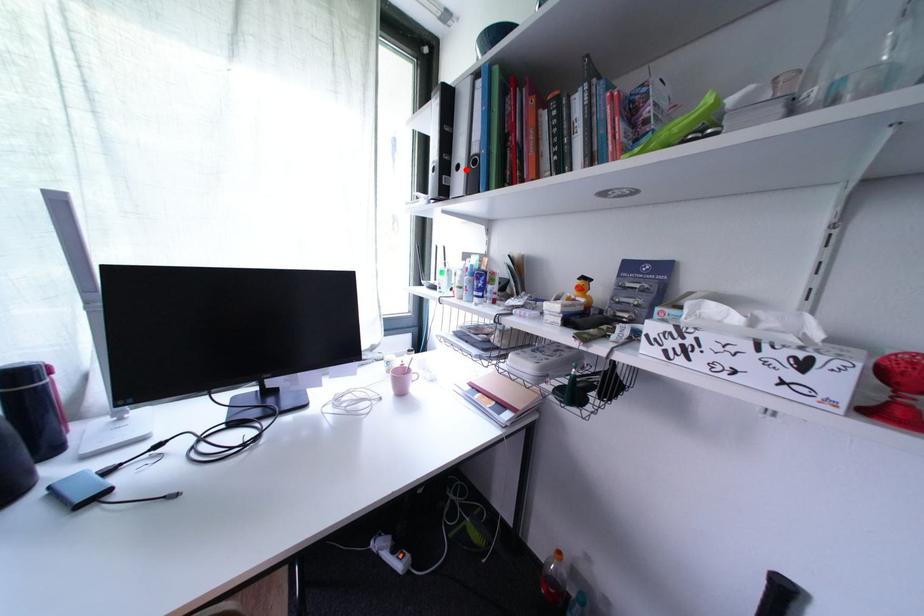
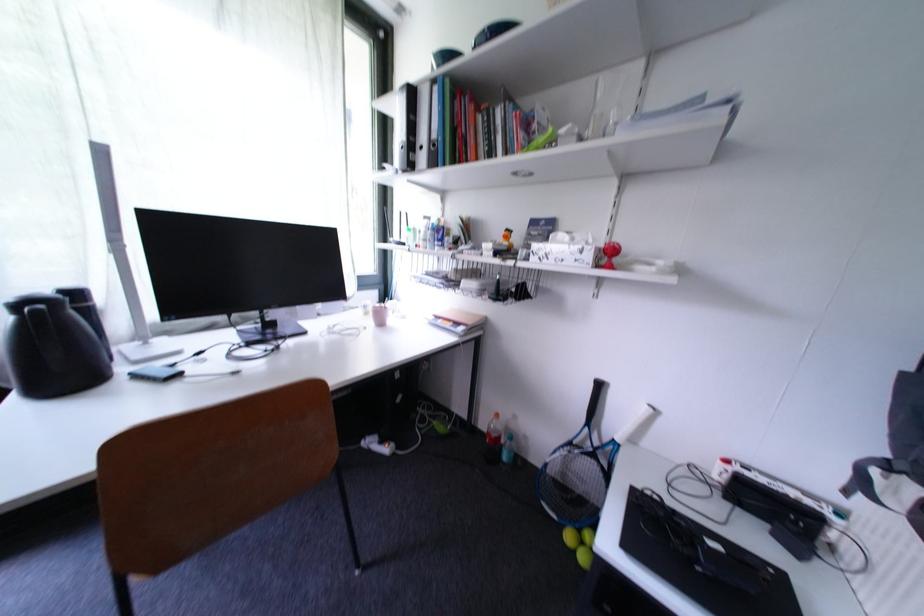
Locate, in the second image, the point that corresponds to the highlighted location in the first image.

(430, 150)